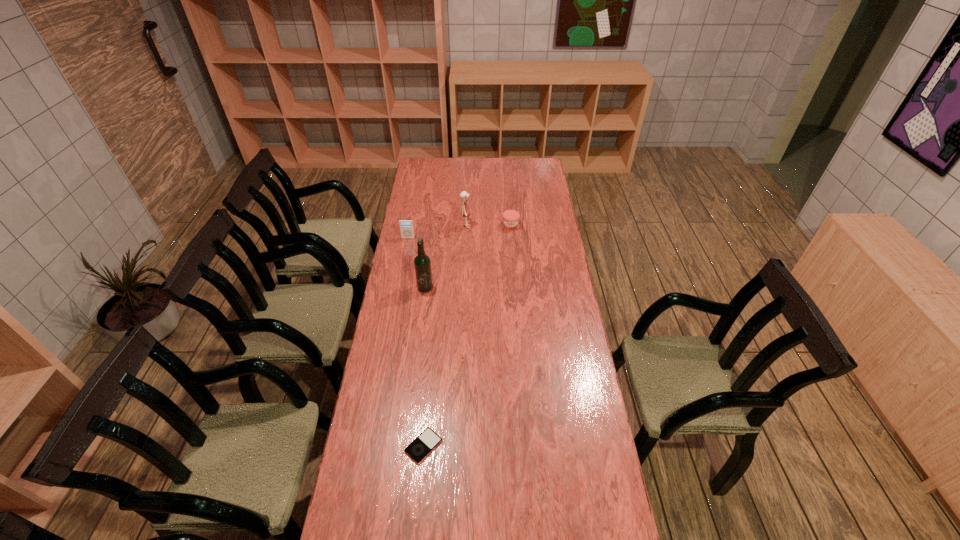
The width and height of the screenshot is (960, 540). Identify the location of vacant space located on the front of the fourth farthest object. coord(417,361).

This screenshot has height=540, width=960. Identify the location of free space located on the front-facing side of the doll. (527, 227).

You are a GUI agent. You are given a task and a screenshot of the screen. Output one action in this format:
    pyautogui.click(x=<x>, y=<y>)
    Task: Click on the vacant point located 0.260m on the front-facing side of the third farthest object
    The height and width of the screenshot is (540, 960).
    Given the screenshot: What is the action you would take?
    pyautogui.click(x=401, y=275)

This screenshot has height=540, width=960. Find the location of `vacant space located on the front label of the rightmost object`. vacant space located on the front label of the rightmost object is located at coordinates (513, 248).

Find the location of `vacant space situated on the front of the nearer iPod`. vacant space situated on the front of the nearer iPod is located at coordinates (420, 481).

I want to click on beer bottle at the left edge, so click(x=422, y=263).

This screenshot has width=960, height=540. Identify the location of vacant space at the left edge of the desktop. (386, 512).

The image size is (960, 540). Find the location of `vacant space at the right edge of the desktop`. vacant space at the right edge of the desktop is located at coordinates (550, 227).

In the image, there is a desktop. Identify the location of free space at the far right corner. The width and height of the screenshot is (960, 540). (518, 159).

Identify the location of free space between the left iPod and the nearest object. (416, 342).